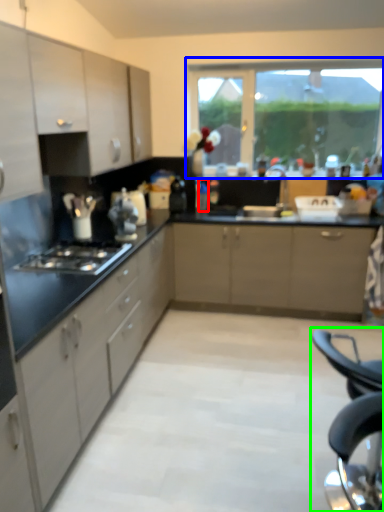
Question: Which is nearer to the bottle (highlighted by a red box)? window (highlighted by a blue box) or folding chair (highlighted by a green box).

Choices:
 (A) window
 (B) folding chair

Answer: (A)